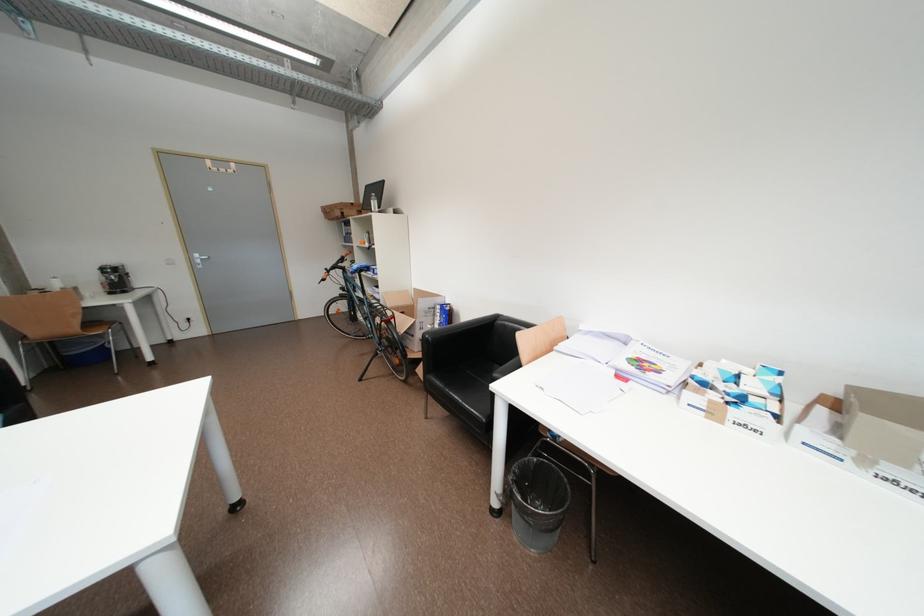
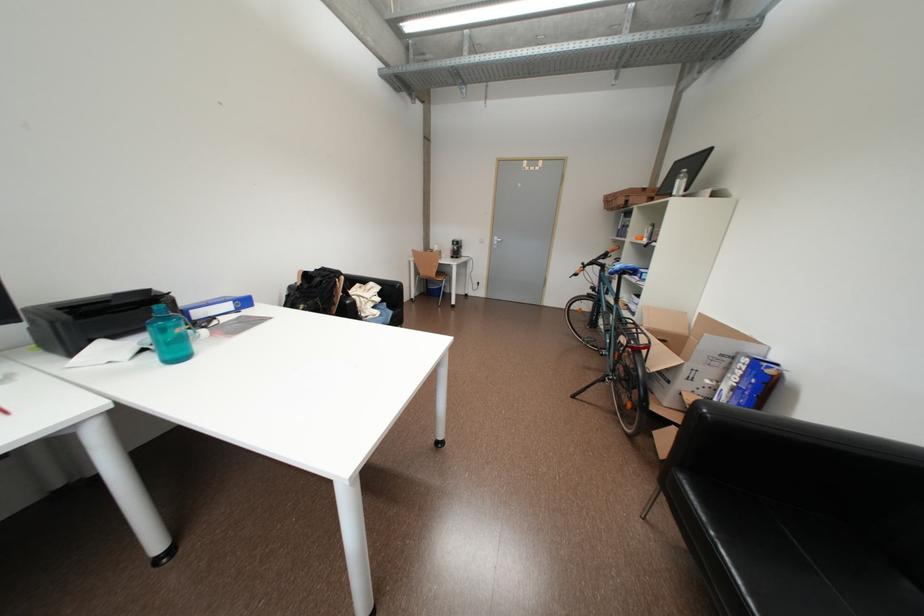
In the second image, find the point that corresponds to point (350, 262) in the first image.

(613, 257)